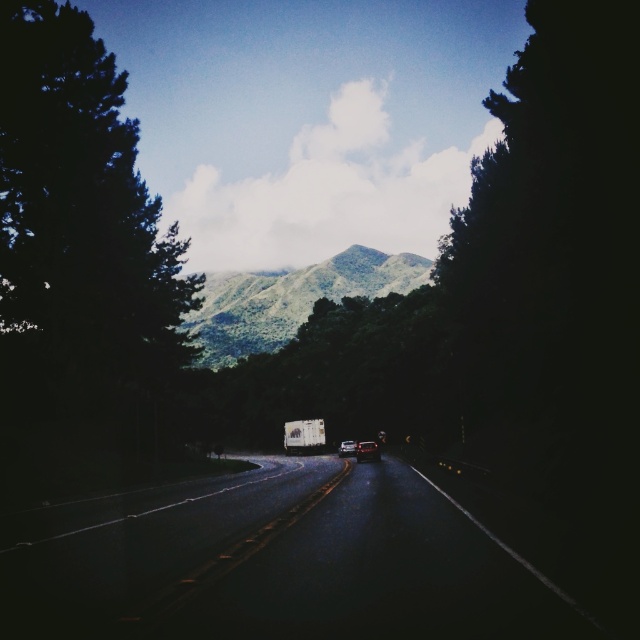
Question: Is green leafy tree at left to the right of green leafy mountain at center from the viewer's perspective?

Choices:
 (A) no
 (B) yes

Answer: (B)

Question: Can you confirm if shiny silver sedan at center is positioned above white matte truck at center?

Choices:
 (A) yes
 (B) no

Answer: (A)

Question: Which is nearer to the dark asphalt road at center?

Choices:
 (A) green leafy tree at left
 (B) white matte truck at center
 (C) white matte trailer truck at center

Answer: (A)

Question: Where is white matte trailer truck at center located in relation to shiny silver sedan at center in the image?

Choices:
 (A) left
 (B) right

Answer: (A)

Question: Among these objects, which one is nearest to the camera?

Choices:
 (A) white matte truck at center
 (B) green leafy tree at left
 (C) dark asphalt road at center

Answer: (C)

Question: Which point is farther to the camera?

Choices:
 (A) (380, 509)
 (B) (346, 451)
 (C) (202, 360)
 (D) (307, 426)

Answer: (C)